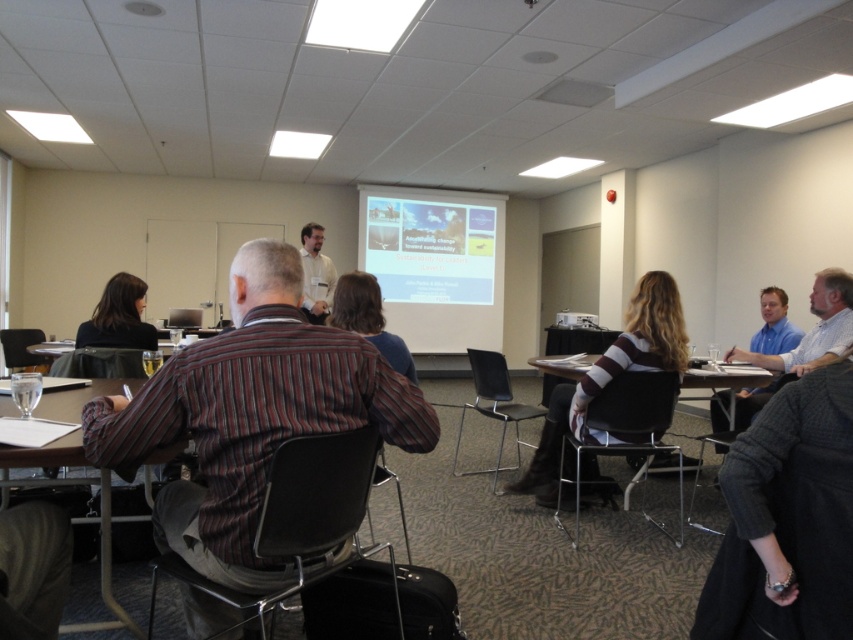
Question: Which point is farther to the camera?

Choices:
 (A) black plastic table at center
 (B) blue shirt at right
 (C) white plastic projector at center

Answer: (C)

Question: Does wooden table at lower left come in front of blue shirt at right?

Choices:
 (A) yes
 (B) no

Answer: (A)

Question: Which object is farther from the camera taking this photo?

Choices:
 (A) wooden table at lower left
 (B) white glossy projector screen at center
 (C) white shirt at center

Answer: (B)

Question: From the image, what is the correct spatial relationship of striped cotton shirt at center in relation to white glossy projector screen at center?

Choices:
 (A) right
 (B) left

Answer: (B)

Question: Estimate the real-world distances between objects in this image. Which object is farther from the white glossy projector screen at center?

Choices:
 (A) black plastic table at center
 (B) striped sweater at center

Answer: (B)

Question: Observing the image, what is the correct spatial positioning of striped sweater at center in reference to white plastic projector at center?

Choices:
 (A) above
 (B) below

Answer: (B)